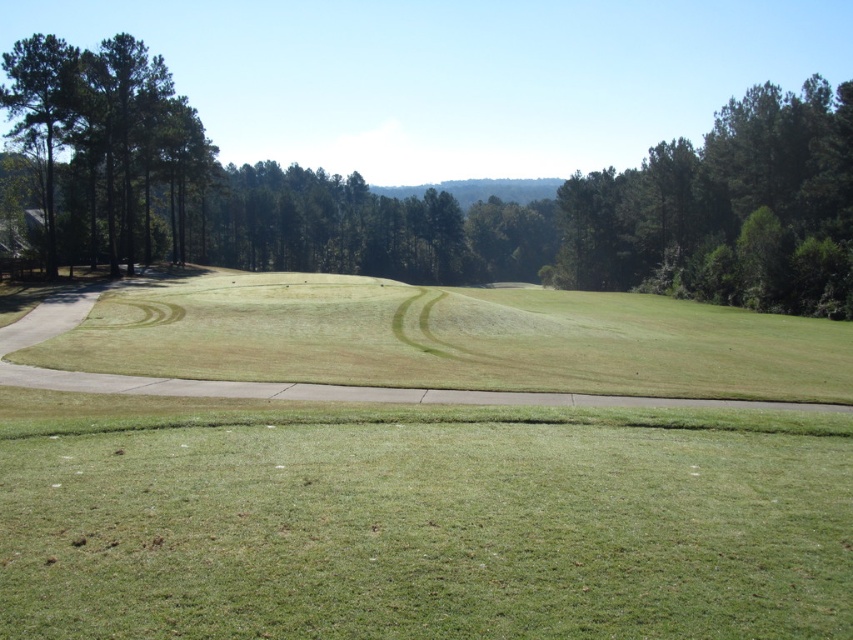
Question: Which object is the closest to the green textured trees at left?

Choices:
 (A) green leafy tree at upper left
 (B) green leafy tree at upper right
 (C) green grass at lower center

Answer: (A)

Question: Is green grass at lower center smaller than green leafy tree at upper right?

Choices:
 (A) no
 (B) yes

Answer: (B)

Question: Which object is farther from the camera taking this photo?

Choices:
 (A) green leafy tree at upper right
 (B) green textured trees at left
 (C) green leafy tree at upper left
 (D) green grass at lower center

Answer: (A)

Question: Which point is farther to the camera?

Choices:
 (A) tap(641, 250)
 (B) tap(303, 492)
 (C) tap(91, 228)

Answer: (A)

Question: Does green leafy tree at upper left appear on the right side of green leafy tree at upper right?

Choices:
 (A) yes
 (B) no

Answer: (A)

Question: Does green leafy tree at upper right appear under green textured trees at left?

Choices:
 (A) yes
 (B) no

Answer: (B)